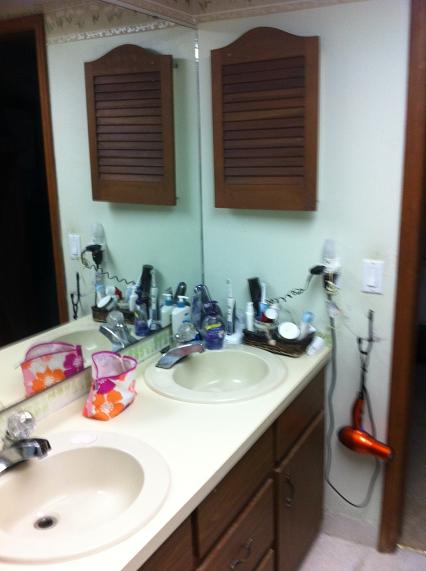
What are the coordinates of `brown cabinet` in the screenshot? It's located at (x=238, y=489), (x=182, y=536), (x=301, y=417).